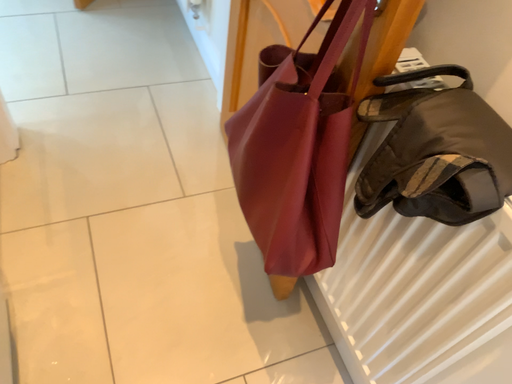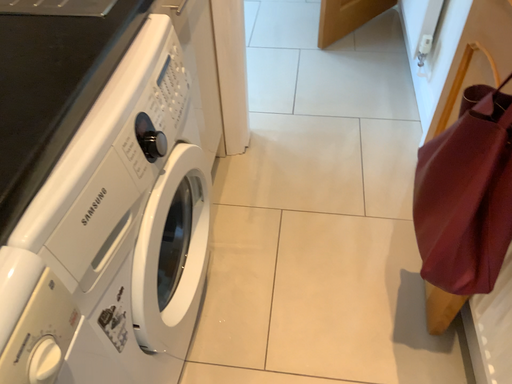
Question: Which way did the camera rotate in the video?

Choices:
 (A) rotated downward
 (B) rotated upward

Answer: (B)